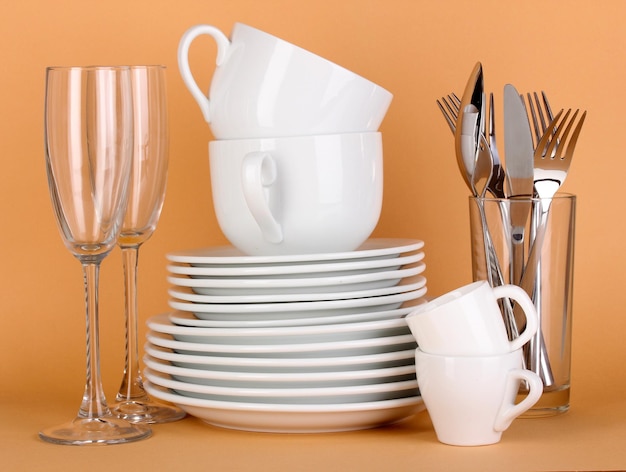
Locate an element on the screen. The width and height of the screenshot is (626, 472). utensils for eating is located at coordinates (550, 171), (538, 111), (521, 160), (500, 188), (488, 161), (470, 158).